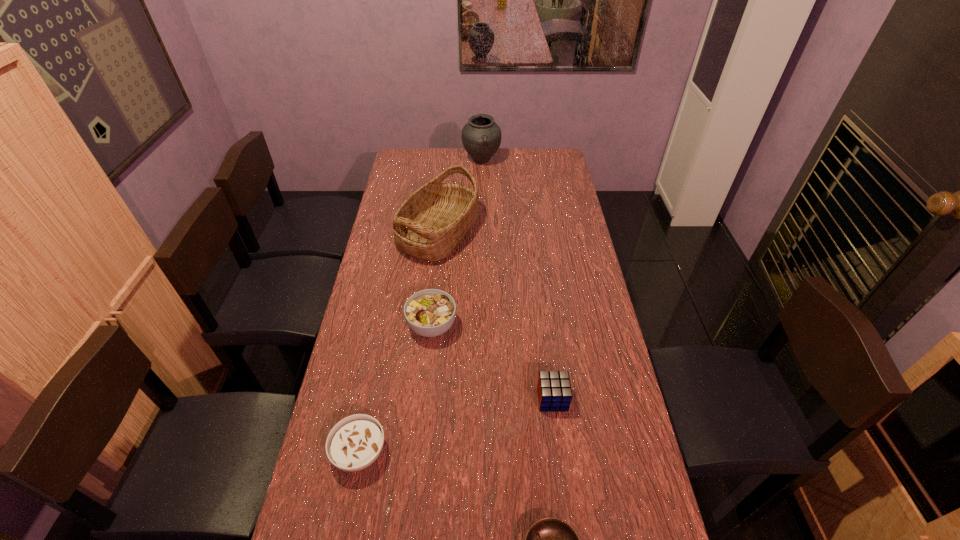
At what (x,y) coordinates should I click in order to perform the action: click on the farthest object. Please return your answer as a coordinate pair (x, y). This screenshot has height=540, width=960. Looking at the image, I should click on (481, 137).

Locate an element on the screen. Image resolution: width=960 pixels, height=540 pixels. basket is located at coordinates (430, 224).

At what (x,y) coordinates should I click in order to perform the action: click on the third farthest object. Please return your answer as a coordinate pair (x, y). Looking at the image, I should click on (431, 312).

Identify the location of the farthest soup bowl. (431, 312).

The width and height of the screenshot is (960, 540). What are the coordinates of `cube` in the screenshot? It's located at (554, 391).

Where is `the leftmost soup bowl`? This screenshot has width=960, height=540. the leftmost soup bowl is located at coordinates (354, 443).

The image size is (960, 540). Find the location of `the second shortest soup bowl`. the second shortest soup bowl is located at coordinates (354, 443).

You are a GUI agent. You are given a task and a screenshot of the screen. Output one action in this format:
    pyautogui.click(x=<x>, y=<y>)
    Task: Click on the vacant space located 0.340m on the left of the urn
    The width and height of the screenshot is (960, 540).
    Given the screenshot: What is the action you would take?
    click(396, 160)

The width and height of the screenshot is (960, 540). Identify the location of free space located on the back of the basket. (444, 178).

The image size is (960, 540). Find the location of `free region located on the right of the fourth nearest object`. free region located on the right of the fourth nearest object is located at coordinates (564, 326).